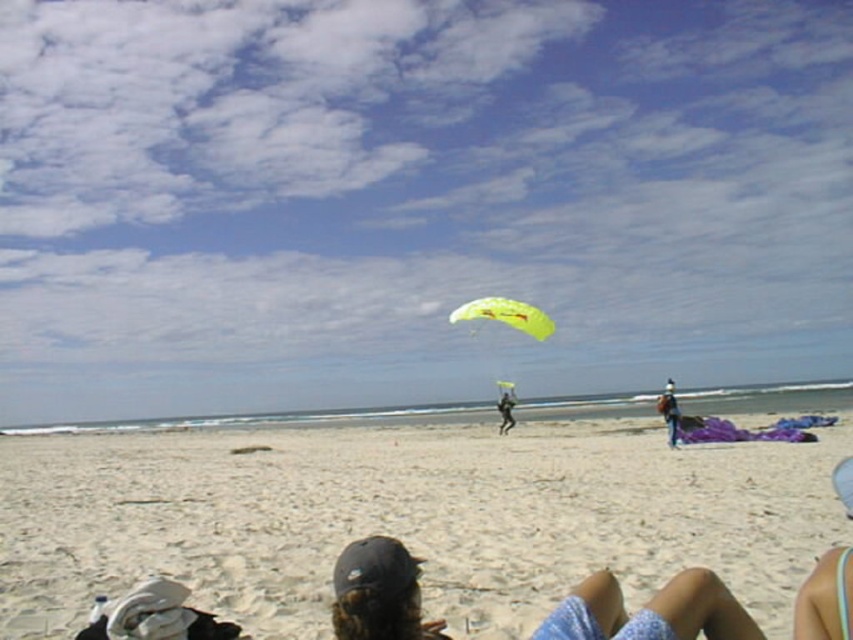
You are standing at the center of the beach and want to walk to the white sand at lower center. Which direction should you face to walk straight towards it?

You should face the lower center direction to walk straight towards the white sand at lower center since it is located at point (x=405, y=518).

You are a photographer at the beach scene described. You want to capture a photo of the transparent yellow parachute at center without any people in the foreground blocking it. Given the current positions of the people on the beach, is this possible?

The transparent yellow parachute at center is located at coordinates point (415, 198). Since the people in the foreground are positioned towards the edges and the center area is clear, it is possible to capture the photo without foreground obstruction.